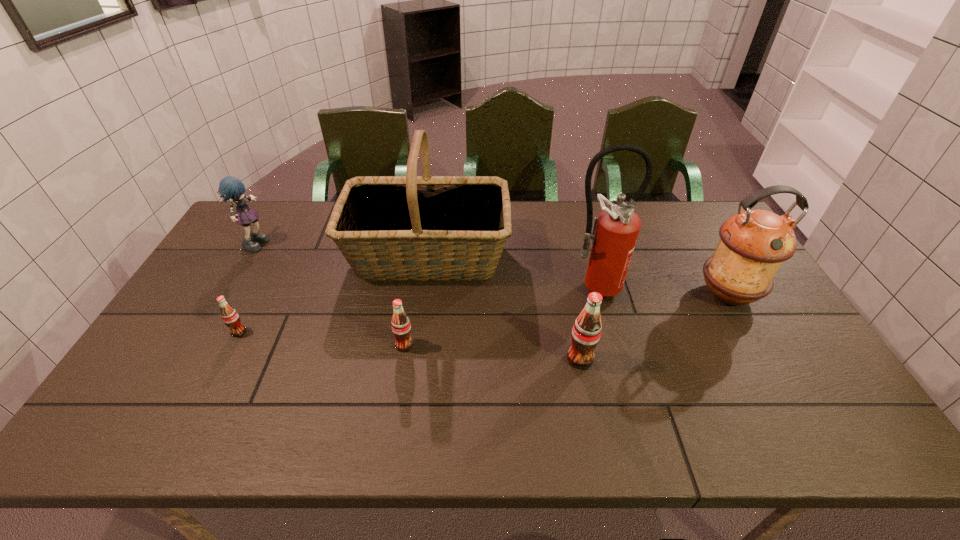
Identify the location of free space between the leftmost soda and the basket. The width and height of the screenshot is (960, 540). (333, 293).

Locate an element on the screen. This screenshot has width=960, height=540. unoccupied area between the tallest object and the sixth object from right to left is located at coordinates [x=416, y=309].

The width and height of the screenshot is (960, 540). I want to click on blank region between the basket and the oil lamp, so click(578, 275).

I want to click on object that can be found as the closest to the second soda from left to right, so click(x=411, y=227).

I want to click on object that is the fourth closest one to the sixth tallest object, so click(x=615, y=230).

Identify which soda is located as the nearest to the rightmost soda. Please provide its 2D coordinates. Your answer should be formatted as a tuple, i.e. [(x, y)], where the tuple contains the x and y coordinates of a point satisfying the conditions above.

[(401, 327)]

Locate which soda ranks second in proximity to the rag doll. Please provide its 2D coordinates. Your answer should be formatted as a tuple, i.e. [(x, y)], where the tuple contains the x and y coordinates of a point satisfying the conditions above.

[(401, 327)]

This screenshot has height=540, width=960. I want to click on free spot that satisfies the following two spatial constraints: 1. by the handle of the basket; 2. on the front side of the shortest soda, so click(418, 332).

Where is `vacant region that satisfies the following two spatial constraints: 1. on the front-facing side of the leftmost object; 2. on the back side of the oil lamp`? This screenshot has height=540, width=960. vacant region that satisfies the following two spatial constraints: 1. on the front-facing side of the leftmost object; 2. on the back side of the oil lamp is located at coordinates (227, 294).

I want to click on free location that satisfies the following two spatial constraints: 1. by the handle of the basket; 2. on the right side of the rightmost soda, so click(414, 359).